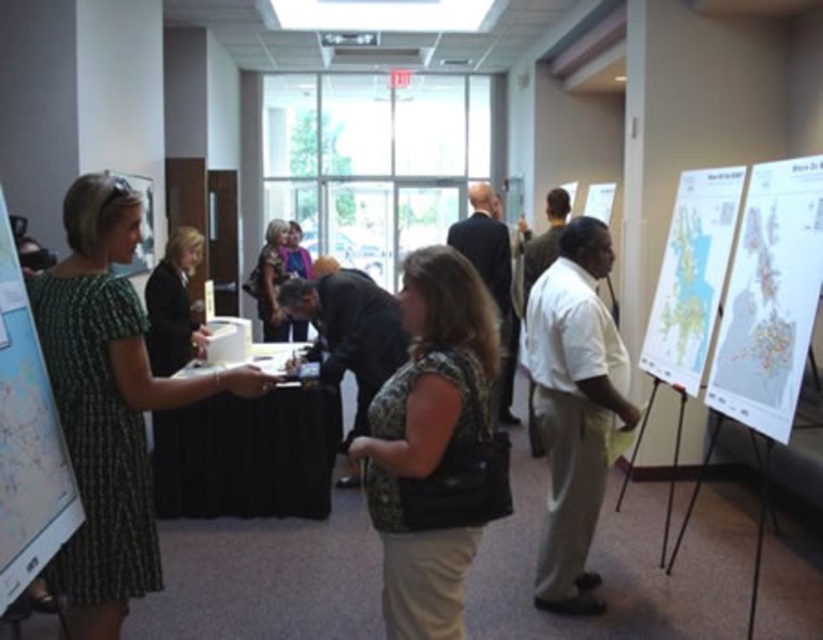
Question: Does green textured dress at left lie in front of camouflage-patterned blouse at center?

Choices:
 (A) no
 (B) yes

Answer: (A)

Question: Where is camouflage-patterned blouse at center located in relation to map paper at right in the image?

Choices:
 (A) right
 (B) left

Answer: (B)

Question: Which object is farther from the camera taking this photo?

Choices:
 (A) matte black poster at upper left
 (B) map paper at right
 (C) white paper map at right
 (D) white paperboard poster at upper right

Answer: (D)

Question: Which of the following is the closest to the observer?

Choices:
 (A) (135, 264)
 (B) (110, 474)

Answer: (B)

Question: Based on their relative distances, which object is nearer to the matte black dress at center?

Choices:
 (A) camouflage-patterned blouse at center
 (B) green textured dress at left

Answer: (B)

Question: Does green textured dress at left appear on the left side of matte black poster at upper left?

Choices:
 (A) no
 (B) yes

Answer: (A)